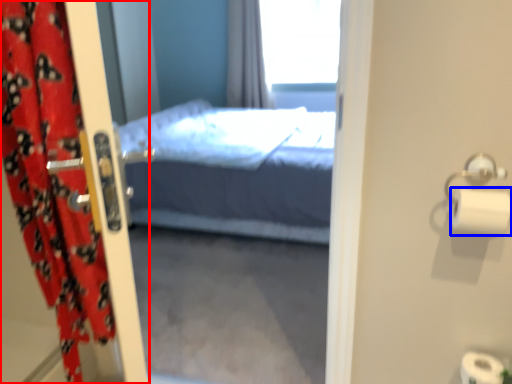
Question: Which of the following is the farthest to the observer, curtain (highlighted by a red box) or toilet paper (highlighted by a blue box)?

Choices:
 (A) curtain
 (B) toilet paper

Answer: (B)